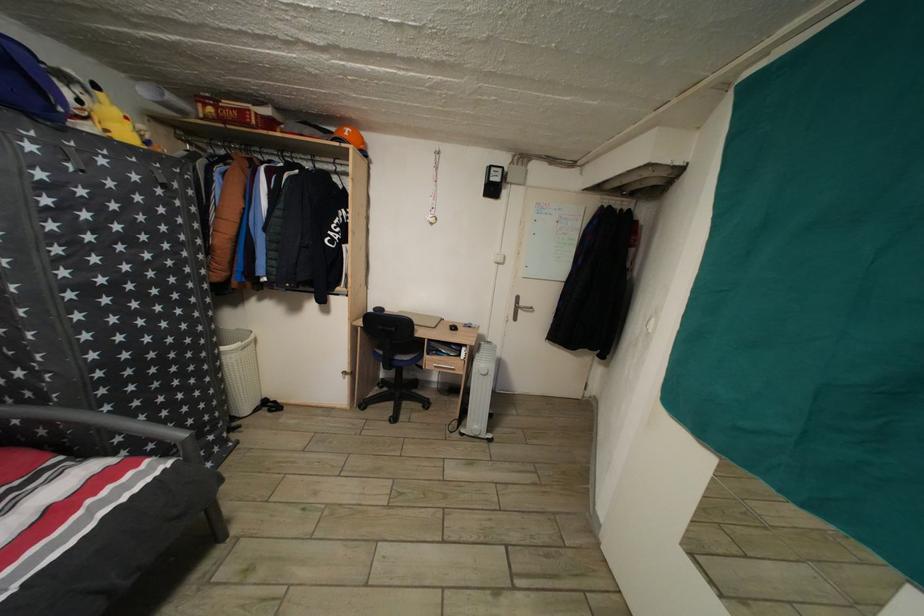
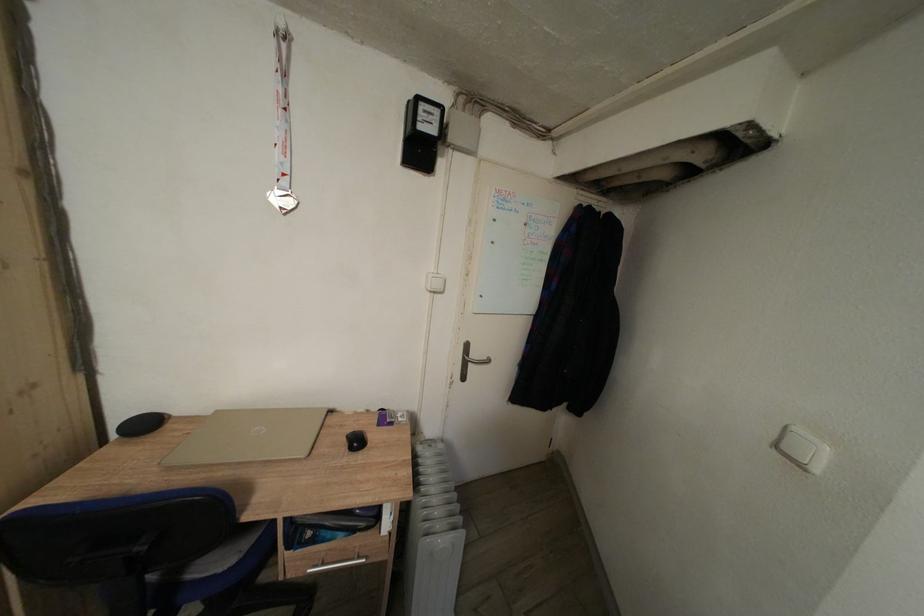
Question: The camera is either moving clockwise (left) or counter-clockwise (right) around the object. The first image is from the beginning of the video and the second image is from the end. Is the camera moving left or right when shooting the video?

Choices:
 (A) Left
 (B) Right

Answer: (A)